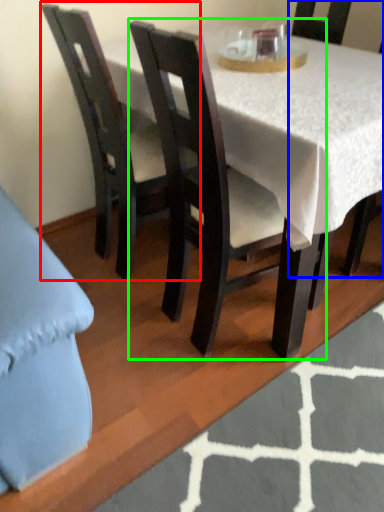
Question: Based on their relative distances, which object is nearer to chair (highlighted by a red box)? Choose from chair (highlighted by a blue box) and chair (highlighted by a green box).

Choices:
 (A) chair
 (B) chair

Answer: (B)